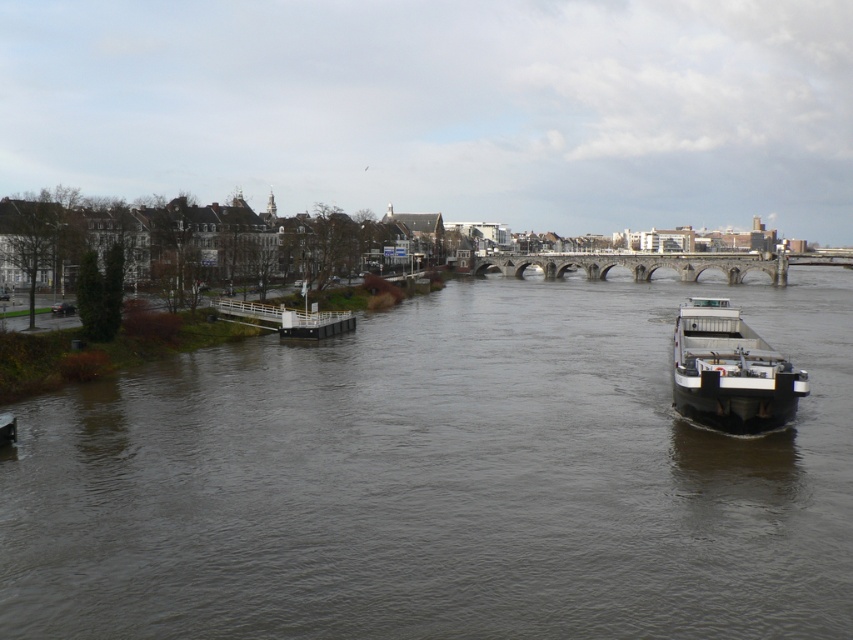
Can you confirm if dark gray water at center is thinner than white matte barge at right?

Incorrect, dark gray water at center's width is not less than white matte barge at right's.

Who is lower down, dark gray water at center or white matte barge at right?

dark gray water at center is below.

Find the location of a particular element. The width and height of the screenshot is (853, 640). dark gray water at center is located at coordinates (444, 480).

Between point (755, 400) and point (666, 257), which one is positioned in front?

Point (755, 400)

Does white matte barge at right appear under stone arch bridge at center?

Yes, white matte barge at right is below stone arch bridge at center.

Does point (752, 332) come in front of point (738, 280)?

Yes, point (752, 332) is in front of point (738, 280).

Identify the location of white matte barge at right. (730, 371).

Who is positioned more to the left, dark gray water at center or stone arch bridge at center?

dark gray water at center

Which is in front, point (813, 598) or point (519, 269)?

Point (813, 598) is in front.

Who is more forward, (167, 522) or (674, 253)?

Point (167, 522) is more forward.

Where is `dark gray water at center`? dark gray water at center is located at coordinates (444, 480).